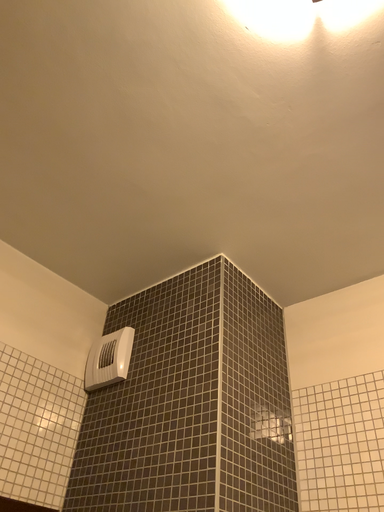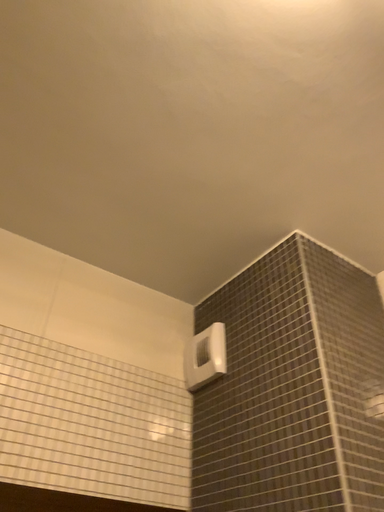
Question: How did the camera likely rotate when shooting the video?

Choices:
 (A) rotated right
 (B) rotated left

Answer: (B)